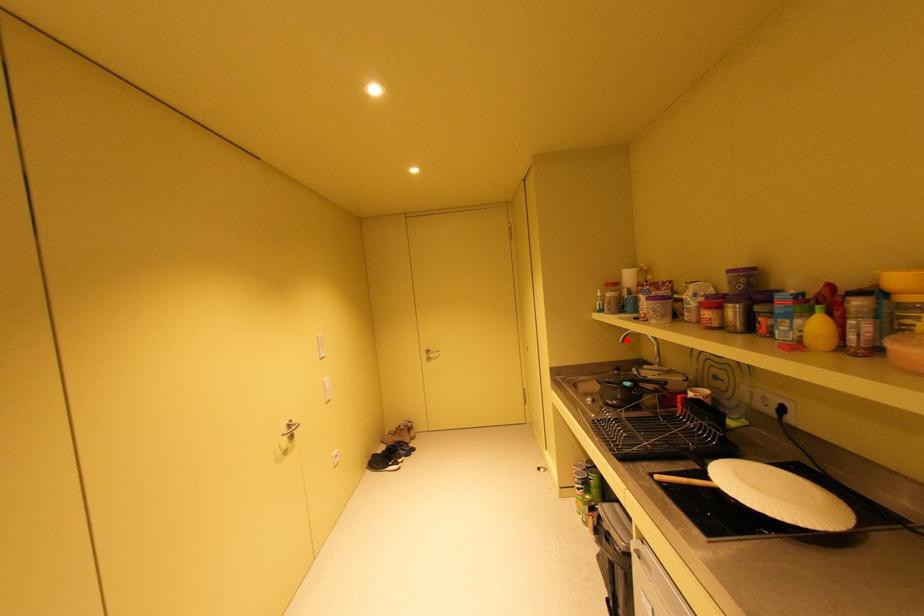
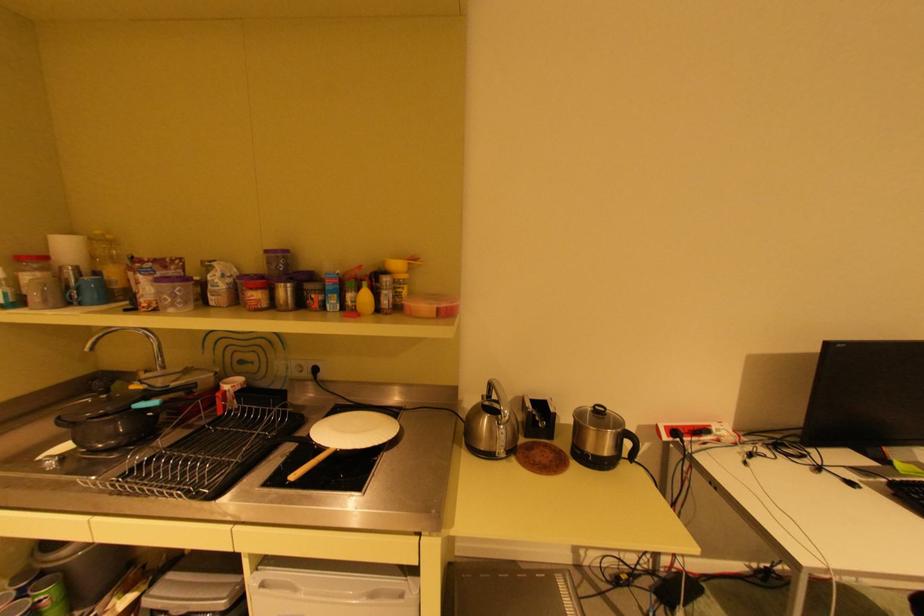
Find the pixel in the second image that matches the highlighted location in the first image.

(92, 347)